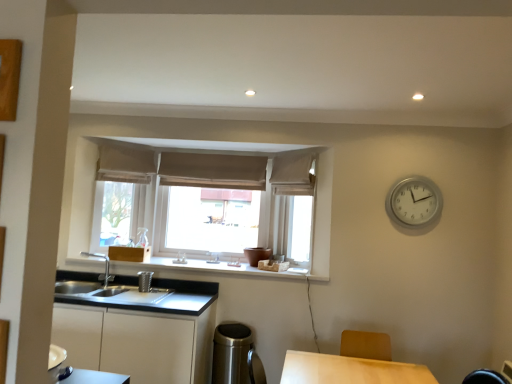
Question: Is beige fabric curtain at upper center, the 1th curtain from the left, positioned far away from brown fabric curtain at center, acting as the second curtain starting from the left?

Choices:
 (A) no
 (B) yes

Answer: (A)

Question: Is beige fabric curtain at upper center, the 1th curtain from the left, shorter than brown fabric curtain at center, acting as the second curtain starting from the left?

Choices:
 (A) yes
 (B) no

Answer: (B)

Question: Does beige fabric curtain at upper center, arranged as the third curtain when viewed from the right, have a smaller size compared to brown fabric curtain at center, marked as the 2th curtain in a right-to-left arrangement?

Choices:
 (A) no
 (B) yes

Answer: (A)

Question: From the image's perspective, would you say beige fabric curtain at upper center, arranged as the third curtain when viewed from the right, is shown under brown fabric curtain at center, acting as the second curtain starting from the left?

Choices:
 (A) no
 (B) yes

Answer: (A)

Question: Does beige fabric curtain at upper center, the 1th curtain from the left, have a lesser width compared to brown fabric curtain at center, marked as the 2th curtain in a right-to-left arrangement?

Choices:
 (A) no
 (B) yes

Answer: (A)

Question: Does beige fabric curtain at upper center, arranged as the third curtain when viewed from the right, have a larger size compared to brown fabric curtain at center, acting as the second curtain starting from the left?

Choices:
 (A) no
 (B) yes

Answer: (B)

Question: Considering the relative positions of white matte window sill at center and beige fabric curtain at upper center, arranged as the third curtain when viewed from the right, in the image provided, is white matte window sill at center in front of beige fabric curtain at upper center, arranged as the third curtain when viewed from the right,?

Choices:
 (A) yes
 (B) no

Answer: (A)

Question: Does white matte window sill at center have a smaller size compared to beige fabric curtain at upper center, arranged as the third curtain when viewed from the right?

Choices:
 (A) yes
 (B) no

Answer: (B)

Question: Is the depth of white matte window sill at center greater than that of beige fabric curtain at upper center, the 1th curtain from the left?

Choices:
 (A) no
 (B) yes

Answer: (A)

Question: Does white matte window sill at center have a lesser width compared to beige fabric curtain at upper center, arranged as the third curtain when viewed from the right?

Choices:
 (A) no
 (B) yes

Answer: (A)

Question: Does white matte window sill at center turn towards beige fabric curtain at upper center, the 1th curtain from the left?

Choices:
 (A) no
 (B) yes

Answer: (A)

Question: Can you confirm if white matte window sill at center is taller than beige fabric curtain at upper center, arranged as the third curtain when viewed from the right?

Choices:
 (A) no
 (B) yes

Answer: (A)

Question: Does white matte cabinet at lower left have a lesser height compared to white matte window sill at center?

Choices:
 (A) yes
 (B) no

Answer: (B)